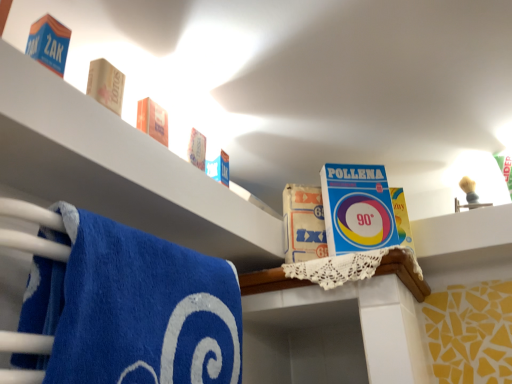
Question: Considering the relative positions of wooden block at upper left, acting as the second product starting from the front, and blue cardboard box at upper left, placed as the third product when sorted from right to left, in the image provided, is wooden block at upper left, acting as the second product starting from the front, to the right of blue cardboard box at upper left, placed as the third product when sorted from right to left, from the viewer's perspective?

Choices:
 (A) no
 (B) yes

Answer: (B)

Question: Is wooden block at upper left, marked as the 2th product in a left-to-right arrangement, closer to the viewer compared to blue cardboard box at upper left, placed as the third product when sorted from back to front?

Choices:
 (A) yes
 (B) no

Answer: (B)

Question: Does wooden block at upper left, acting as the second product starting from the front, turn towards blue cardboard box at upper left, marked as the first product in a top-to-bottom arrangement?

Choices:
 (A) yes
 (B) no

Answer: (B)

Question: Is wooden block at upper left, marked as the 2th product in a left-to-right arrangement, smaller than blue cardboard box at upper left, placed as the third product when sorted from back to front?

Choices:
 (A) no
 (B) yes

Answer: (A)

Question: Considering the relative positions of wooden block at upper left, marked as the 2th product in a left-to-right arrangement, and blue cardboard box at upper left, the 3th product from the bottom, in the image provided, is wooden block at upper left, marked as the 2th product in a left-to-right arrangement, to the left of blue cardboard box at upper left, the 3th product from the bottom, from the viewer's perspective?

Choices:
 (A) no
 (B) yes

Answer: (A)

Question: Is wooden block at upper left, marked as the 2th product in a left-to-right arrangement, inside the boundaries of blue cardboard box at upper left, the 3th product from the bottom, or outside?

Choices:
 (A) inside
 (B) outside

Answer: (B)

Question: Based on their positions, is wooden block at upper left, acting as the 2th product starting from the back, located to the left or right of blue cardboard box at upper left, placed as the 1th product when sorted from front to back?

Choices:
 (A) left
 (B) right

Answer: (B)

Question: Considering the positions of wooden block at upper left, the second product in the bottom-to-top sequence, and blue cardboard box at upper left, placed as the 1th product when sorted from front to back, in the image, is wooden block at upper left, the second product in the bottom-to-top sequence, wider or thinner than blue cardboard box at upper left, placed as the 1th product when sorted from front to back,?

Choices:
 (A) wide
 (B) thin

Answer: (A)

Question: From their relative heights in the image, would you say wooden block at upper left, acting as the 2th product starting from the back, is taller or shorter than blue cardboard box at upper left, the 3th product from the bottom?

Choices:
 (A) short
 (B) tall

Answer: (B)

Question: Is wooden block at upper left, the second product in the bottom-to-top sequence, spatially inside blue terry cloth towel at lower left, or outside of it?

Choices:
 (A) inside
 (B) outside

Answer: (B)

Question: In terms of width, does wooden block at upper left, which ranks as the second product in right-to-left order, look wider or thinner when compared to blue terry cloth towel at lower left?

Choices:
 (A) thin
 (B) wide

Answer: (A)

Question: From the image's perspective, is wooden block at upper left, the second product in the bottom-to-top sequence, located above or below blue terry cloth towel at lower left?

Choices:
 (A) above
 (B) below

Answer: (A)

Question: Looking at the image, does wooden block at upper left, acting as the 2th product starting from the back, seem bigger or smaller compared to blue terry cloth towel at lower left?

Choices:
 (A) big
 (B) small

Answer: (B)

Question: From a real-world perspective, is blue cardboard box at upper center, the 1th product in the back-to-front sequence, above or below blue cardboard box at upper left, which ranks as the first product in left-to-right order?

Choices:
 (A) above
 (B) below

Answer: (B)

Question: From the image's perspective, relative to blue cardboard box at upper left, marked as the first product in a top-to-bottom arrangement, is blue cardboard box at upper center, the first product when ordered from bottom to top, above or below?

Choices:
 (A) above
 (B) below

Answer: (B)